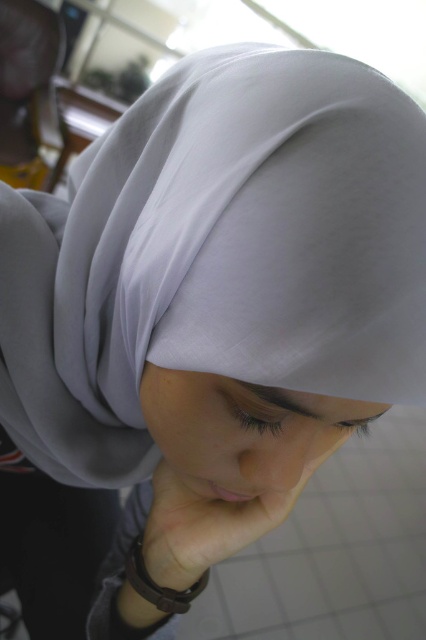
Question: Is smooth skin at center positioned before pink smooth skin at lower center?

Choices:
 (A) no
 (B) yes

Answer: (B)

Question: Does smooth skin at center have a smaller size compared to pink smooth skin at lower center?

Choices:
 (A) no
 (B) yes

Answer: (A)

Question: Can you confirm if smooth skin at center is thinner than pink smooth skin at lower center?

Choices:
 (A) yes
 (B) no

Answer: (B)

Question: Which point is farther to the camera?

Choices:
 (A) (207, 484)
 (B) (236, 493)

Answer: (A)

Question: Which object appears farthest from the camera in this image?

Choices:
 (A) smooth skin at center
 (B) pink smooth skin at lower center

Answer: (B)